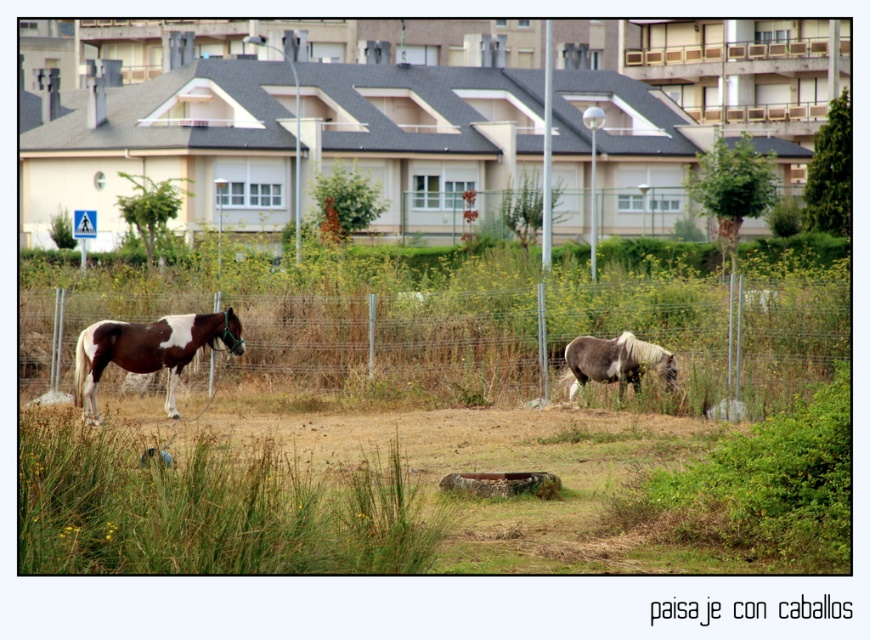
You are a photographer standing outside the enclosure trying to capture a clear shot of the brown and white speckled horse at left. However, the wire mesh fence at center is blocking your view. Can you move to a position where the horse is no longer obscured by the fence?

The wire mesh fence at center is in front of the brown and white speckled horse at left, so you cannot move to a position where the horse is no longer obscured by the fence since the fence is already blocking the direct view.

You are a delivery drone that needs to fly from the horse on the left to the horse on the right. The wire mesh fence at center is in your path. Can you safely pass through the gap between the two horses without hitting the fence?

The wire mesh fence at center is 65.99 feet apart, so the drone can safely pass through the gap between the two horses without hitting the fence since the distance is sufficient.

You are a delivery drone that needs to pass through the area between the wire mesh fence at center and the brown and white speckled horse at left. Can you safely navigate through this space?

The wire mesh fence at center is larger than the brown and white speckled horse at left, so the space between them may be sufficient for the drone to pass through safely.